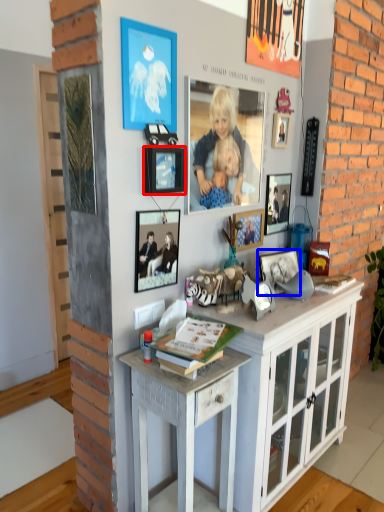
Question: Which point is closer to the camera, picture frame (highlighted by a red box) or picture frame (highlighted by a blue box)?

Choices:
 (A) picture frame
 (B) picture frame

Answer: (A)